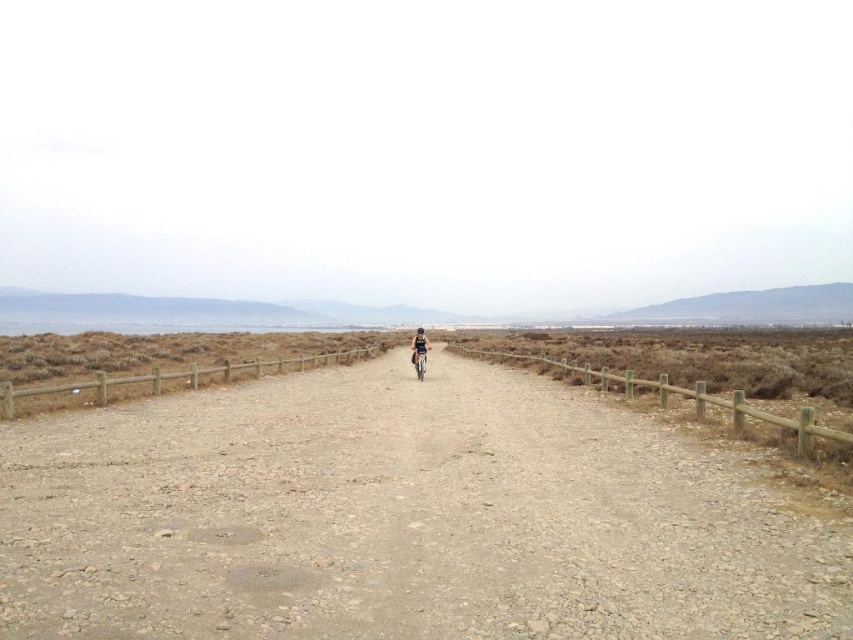
Question: Which object is closer to the camera taking this photo?

Choices:
 (A) brown wooden fence at left
 (B) denim shorts at center
 (C) wooden fence at right
 (D) dull brown dirt track at center

Answer: (D)

Question: Is denim shorts at center bigger than metallic silver bicycle at center?

Choices:
 (A) no
 (B) yes

Answer: (B)

Question: Among these points, which one is farthest from the camera?

Choices:
 (A) (227, 630)
 (B) (425, 356)
 (C) (412, 362)

Answer: (B)

Question: Which point appears farthest from the camera in this image?

Choices:
 (A) (422, 337)
 (B) (422, 364)
 (C) (154, 392)

Answer: (A)

Question: In this image, where is brown wooden fence at left located relative to denim shorts at center?

Choices:
 (A) right
 (B) left

Answer: (B)

Question: Can you confirm if wooden fence at right is wider than denim shorts at center?

Choices:
 (A) no
 (B) yes

Answer: (B)